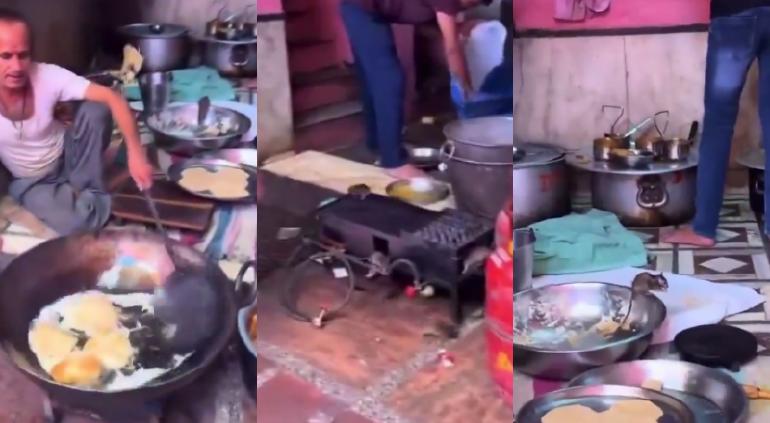
Identify the location of wok. (176, 321).